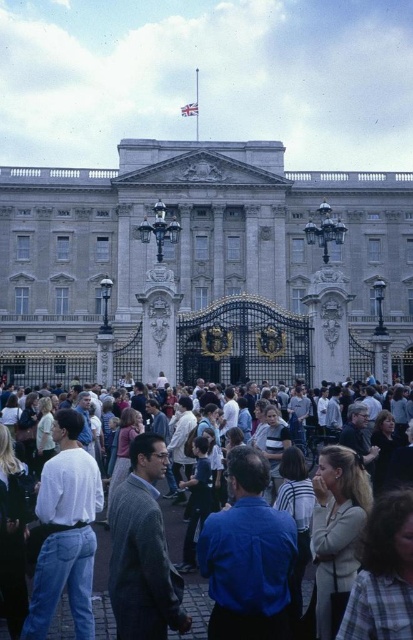
Question: Which point is farther to the camera?

Choices:
 (A) light beige jacket at center
 (B) gray wool suit at center

Answer: (B)

Question: Which point is farther to the camera?

Choices:
 (A) blue denim jeans at lower left
 (B) light beige jacket at center
 (C) white cotton shirt at center
 (D) white stone building at center

Answer: (D)

Question: Is plaid shirt at lower right below blue denim jeans at lower left?

Choices:
 (A) no
 (B) yes

Answer: (A)

Question: Is plaid shirt at lower right below blue denim jeans at lower left?

Choices:
 (A) yes
 (B) no

Answer: (B)

Question: Which of the following is the closest to the observer?

Choices:
 (A) plaid shirt at lower right
 (B) light beige jacket at center
 (C) white stone building at center

Answer: (A)

Question: Is plaid shirt at lower right smaller than blue denim jeans at lower left?

Choices:
 (A) no
 (B) yes

Answer: (B)